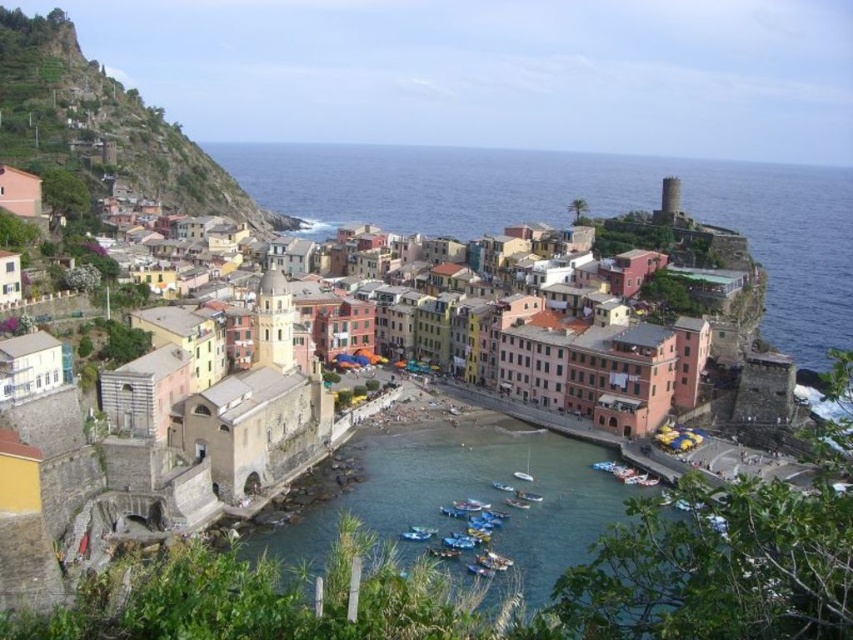
You are standing at the point marked as point (x=103, y=124) in the image. Looking around, you see the colorful buildings of the coastal town. What type of structures are you closest to?

You are closest to rustic stone houses at upper left, as point (x=103, y=124) corresponds to rustic stone houses at upper left.

You are standing at the viewpoint overlooking the coastal town. You notice two points marked on the map as point 1 at coordinates point (10, 141) and point 2 at coordinates point (421, 532). Which point is closer to the edge of the cliff overlooking the sea?

Point (10, 141) is behind point (421, 532), so point (421, 532) is closer to the edge of the cliff overlooking the sea.